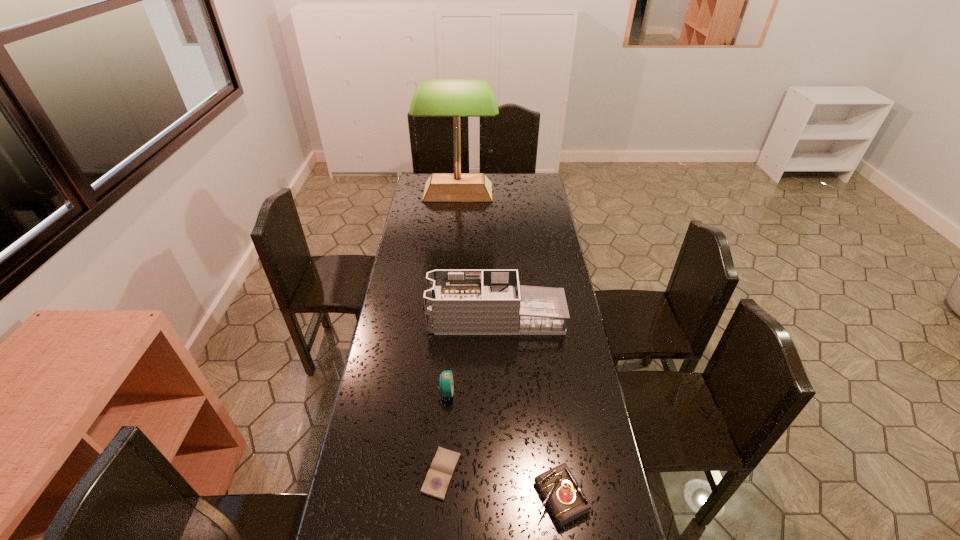
Where is `the farthest object`? Image resolution: width=960 pixels, height=540 pixels. the farthest object is located at coordinates (456, 98).

Where is `the tallest object`? This screenshot has height=540, width=960. the tallest object is located at coordinates (456, 98).

This screenshot has width=960, height=540. What are the coordinates of `the fourth shortest object` in the screenshot? It's located at click(457, 302).

Locate an element on the screen. Image resolution: width=960 pixels, height=540 pixels. the fourth nearest object is located at coordinates pyautogui.click(x=457, y=302).

At what (x,y) coordinates should I click in order to perform the action: click on the third tallest object. Please return your answer as a coordinate pair (x, y). This screenshot has height=540, width=960. Looking at the image, I should click on (446, 381).

Where is `alarm clock`? alarm clock is located at coordinates (446, 381).

Identify the location of the right diary. (x=566, y=500).

You are a GUI agent. You are given a task and a screenshot of the screen. Output one action in this format:
    pyautogui.click(x=<x>, y=<y>)
    Task: Click on the taller diary
    The height and width of the screenshot is (540, 960).
    Given the screenshot: What is the action you would take?
    pyautogui.click(x=566, y=500)

Identify the location of the left diary. The image size is (960, 540). (438, 478).

Locate an element on the screen. This screenshot has width=960, height=540. the shortest object is located at coordinates (438, 478).